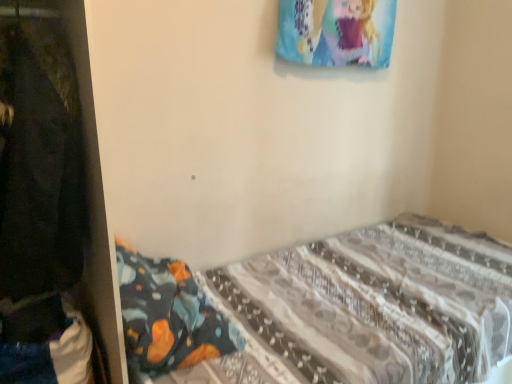
Question: Considering the positions of point (58, 105) and point (181, 319), is point (58, 105) closer or farther from the camera than point (181, 319)?

Choices:
 (A) closer
 (B) farther

Answer: (A)

Question: Is black fabric at left taller or shorter than patterned fabric bed at lower right?

Choices:
 (A) short
 (B) tall

Answer: (B)

Question: From a real-world perspective, is black fabric at left positioned above or below patterned fabric bed at lower right?

Choices:
 (A) below
 (B) above

Answer: (B)

Question: In the image, is patterned fabric bed at lower right positioned in front of or behind black fabric at left?

Choices:
 (A) behind
 (B) front

Answer: (A)

Question: Is patterned fabric bed at lower right wider or thinner than black fabric at left?

Choices:
 (A) thin
 (B) wide

Answer: (B)

Question: Is point (236, 319) closer or farther from the camera than point (95, 115)?

Choices:
 (A) farther
 (B) closer

Answer: (A)

Question: From a real-world perspective, is patterned fabric bed at lower right positioned above or below black fabric at left?

Choices:
 (A) below
 (B) above

Answer: (A)